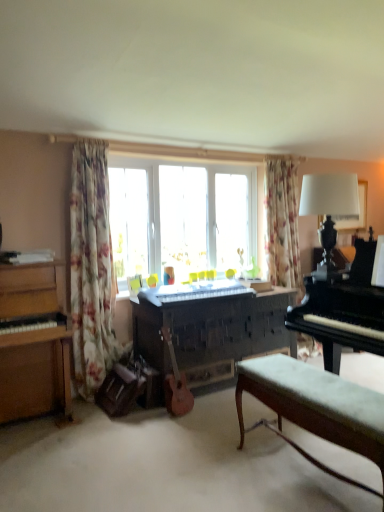
Where is `vacant space underneath velvet green bench at lower right (from a real-world perspective)`? The height and width of the screenshot is (512, 384). vacant space underneath velvet green bench at lower right (from a real-world perspective) is located at coordinates (306, 476).